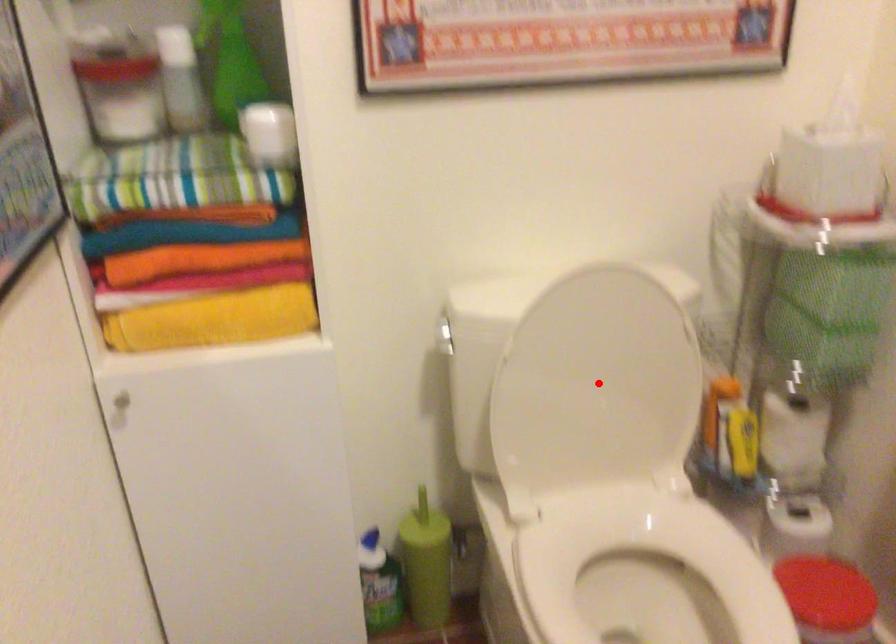
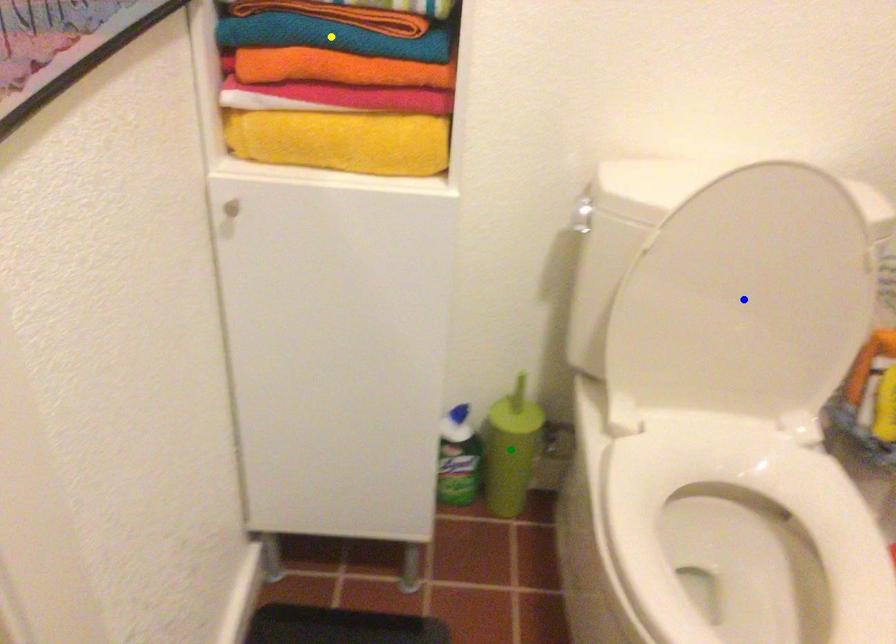
Question: I am providing you with two images of the same scene from different viewpoints. A red point is marked on the first image. You are given multiple points on the second image. Can you choose the point in image 2 that corresponds to the point in image 1?

Choices:
 (A) yellow point
 (B) blue point
 (C) green point

Answer: (B)